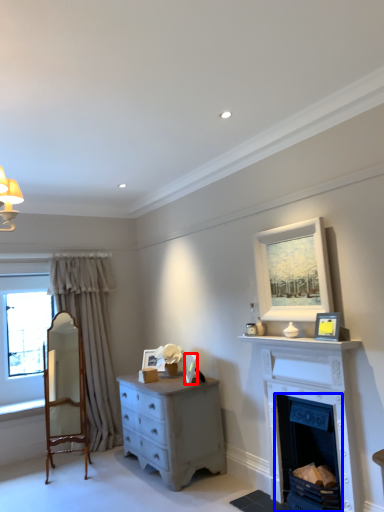
Question: Among these objects, which one is nearest to the camera, picture frame (highlighted by a red box) or fireplace (highlighted by a blue box)?

Choices:
 (A) picture frame
 (B) fireplace

Answer: (B)